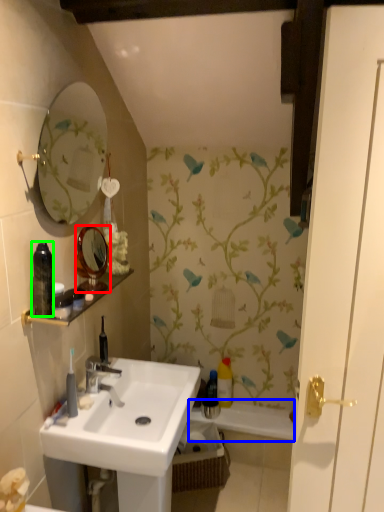
Question: Considering the real-world distances, which object is closest to mirror (highlighted by a red box)? bath (highlighted by a blue box) or toiletry (highlighted by a green box).

Choices:
 (A) bath
 (B) toiletry

Answer: (B)